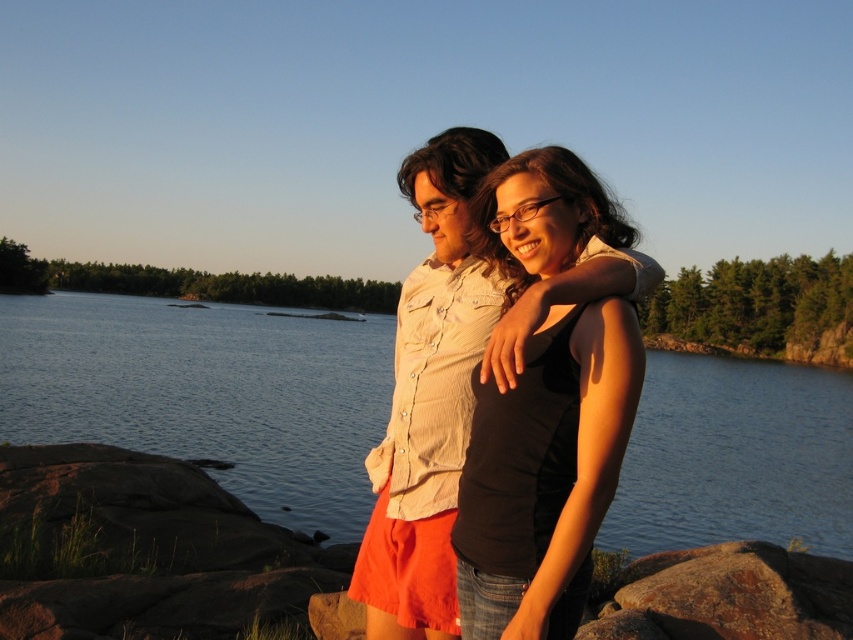
Which is more to the right, clear water at center or black matte tank top at center?

Positioned to the right is black matte tank top at center.

Does clear water at center have a larger size compared to black matte tank top at center?

Correct, clear water at center is larger in size than black matte tank top at center.

Find the location of a particular element. clear water at center is located at coordinates (206, 394).

You are a GUI agent. You are given a task and a screenshot of the screen. Output one action in this format:
    pyautogui.click(x=<x>, y=<y>)
    Task: Click on the clear water at center
    The image size is (853, 640).
    Given the screenshot: What is the action you would take?
    pyautogui.click(x=206, y=394)